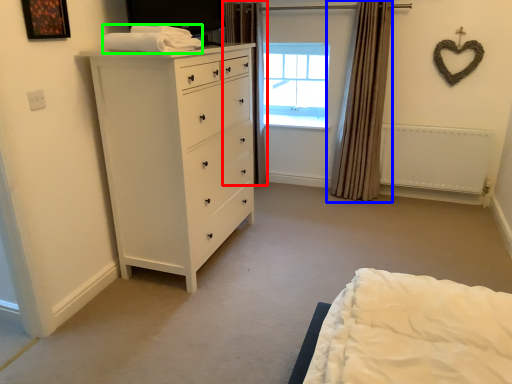
Question: Estimate the real-world distances between objects in this image. Which object is farther from curtain (highlighted by a red box), curtain (highlighted by a blue box) or blanket (highlighted by a green box)?

Choices:
 (A) curtain
 (B) blanket

Answer: (B)